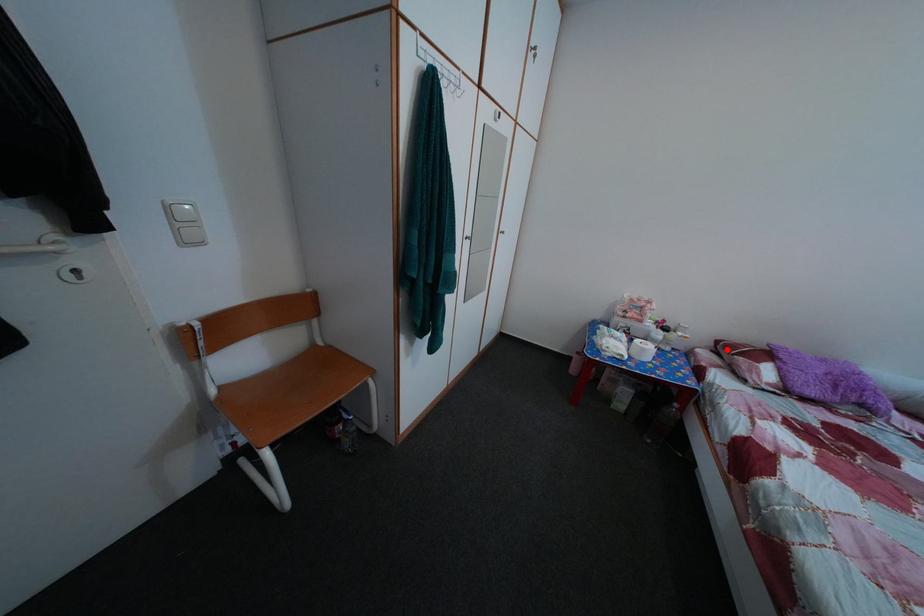
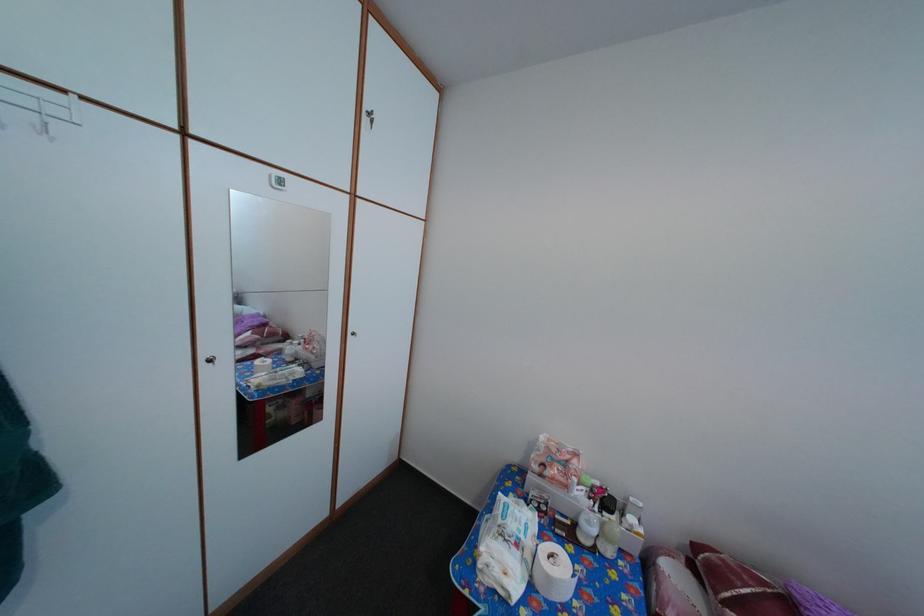
Locate, in the second image, the point that corresponds to the highlighted location in the first image.

(704, 554)